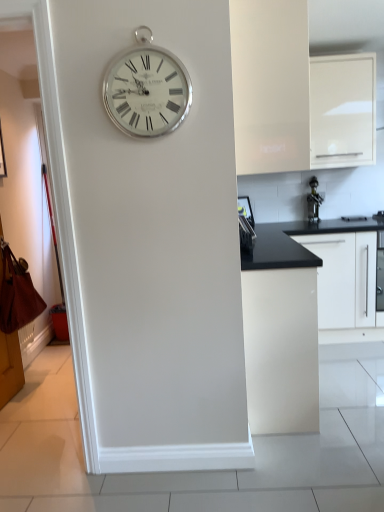
Question: Is point (367, 308) closer or farther from the camera than point (248, 230)?

Choices:
 (A) farther
 (B) closer

Answer: (A)

Question: From a real-world perspective, is white matte cabinet at right, acting as the 4th cabinetry starting from the left, above or below satin black knife block at right, the first appliance when ordered from left to right?

Choices:
 (A) above
 (B) below

Answer: (B)

Question: Which object is positioned closest to the white matte cabinet at upper center, which appears as the fourth cabinetry when viewed from the right?

Choices:
 (A) white matte cabinet at right, acting as the 4th cabinetry starting from the left
 (B) satin black knife block at right, which appears as the 2th appliance when viewed from the right
 (C) silver metallic clock at upper center
 (D) metallic silver faucet at right, which appears as the first appliance when viewed from the back
 (E) white glossy cabinet at upper right, placed as the 3th cabinetry when sorted from left to right

Answer: (C)

Question: Estimate the real-world distances between objects in this image. Which object is farther from the white glossy cabinet at upper right, acting as the 2th cabinetry starting from the right?

Choices:
 (A) white matte cabinet at right, which is the 1th cabinetry in right-to-left order
 (B) white glossy cabinet at center, the third cabinetry when ordered from right to left
 (C) silver metallic clock at upper center
 (D) white matte cabinet at upper center, positioned as the 1th cabinetry in left-to-right order
 (E) metallic silver faucet at right, which appears as the first appliance when viewed from the back

Answer: (C)